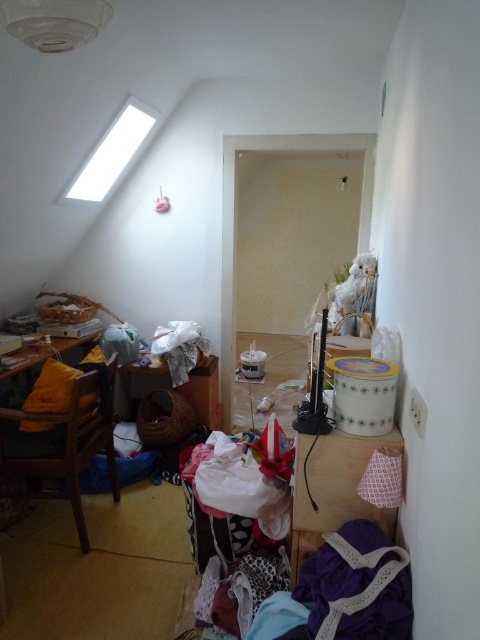
You are moving a box from the doorway to the wooden table at center. There is a purple lace fabric at lower right in the way. Can you walk directly to the table without stepping on the fabric?

The purple lace fabric at lower right is in front of the wooden table at center, so you would have to step over or move the fabric to reach the table without stepping on it.

You are standing at the entrance of the room and need to place a new item on the wooden table at center. Based on its coordinates, can you estimate its position relative to the skylight at the top left corner?

The wooden table at center is located at coordinates point [204,392], which places it closer to the right side and lower part of the room compared to the skylight at the top left corner. Therefore, the wooden table at center is positioned to the right and below the skylight.